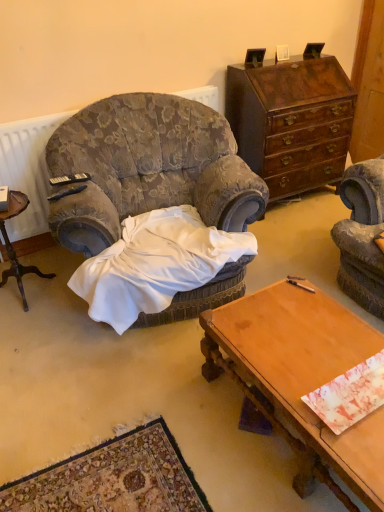
Where is `free space behind marbled paper at center`? This screenshot has height=512, width=384. free space behind marbled paper at center is located at coordinates (323, 337).